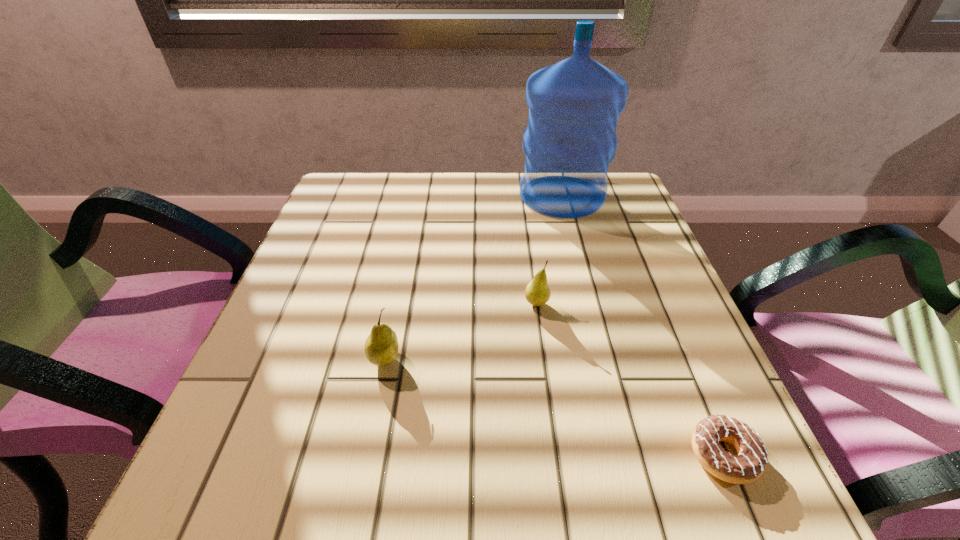
At what (x,y) coordinates should I click in order to perform the action: click on free space that is in between the doughnut and the nearer pear. Please return your answer as a coordinate pair (x, y). Looking at the image, I should click on (554, 407).

This screenshot has height=540, width=960. Find the location of `vacant area that lies between the tallest object and the third farthest object`. vacant area that lies between the tallest object and the third farthest object is located at coordinates (473, 277).

The width and height of the screenshot is (960, 540). I want to click on free point between the leftmost object and the water jug, so click(473, 277).

Select which object appears as the closest to the third farthest object. Please provide its 2D coordinates. Your answer should be formatted as a tuple, i.e. [(x, y)], where the tuple contains the x and y coordinates of a point satisfying the conditions above.

[(537, 292)]

At what (x,y) coordinates should I click in order to perform the action: click on the third closest object to the farther pear. Please return your answer as a coordinate pair (x, y). This screenshot has height=540, width=960. Looking at the image, I should click on click(x=750, y=463).

Locate an element on the screen. vacant area in the image that satisfies the following two spatial constraints: 1. on the front side of the nearest object; 2. on the left side of the farther pear is located at coordinates (557, 455).

Where is `vacant region that satisfies the following two spatial constraints: 1. on the front side of the shortest object; 2. on the left side of the nearer pear`? The image size is (960, 540). vacant region that satisfies the following two spatial constraints: 1. on the front side of the shortest object; 2. on the left side of the nearer pear is located at coordinates (366, 455).

This screenshot has height=540, width=960. I want to click on vacant region that satisfies the following two spatial constraints: 1. on the front side of the nearest object; 2. on the left side of the left pear, so click(x=366, y=455).

The width and height of the screenshot is (960, 540). I want to click on vacant area that satisfies the following two spatial constraints: 1. on the back side of the second nearest object; 2. on the left side of the right pear, so click(396, 303).